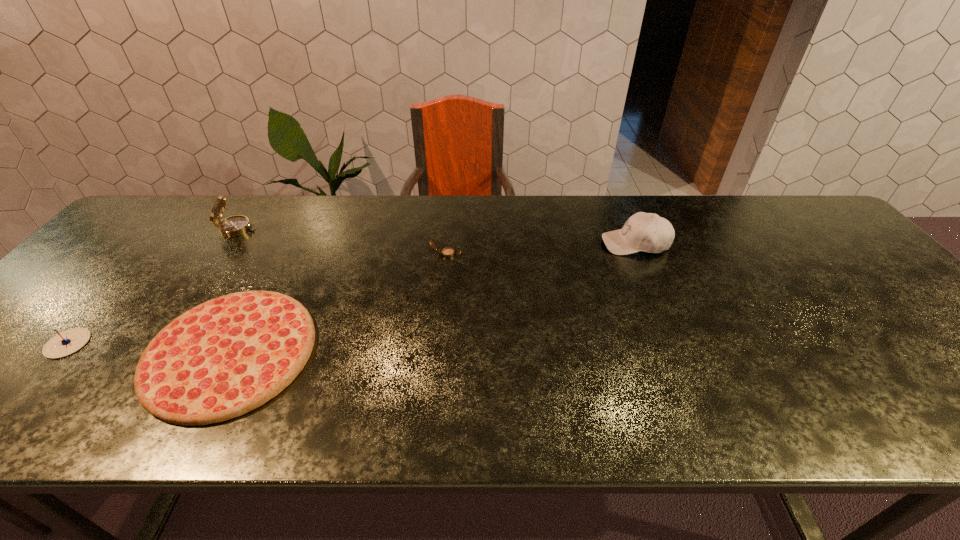
You are a GUI agent. You are given a task and a screenshot of the screen. Output one action in this format:
    pyautogui.click(x=<x>, y=<y>)
    Task: Click on the free space at the near edge of the desktop
    The image size is (960, 540).
    Given the screenshot: What is the action you would take?
    pyautogui.click(x=915, y=403)

Locate an element on the screen. The width and height of the screenshot is (960, 540). blank area at the left edge is located at coordinates (138, 240).

The height and width of the screenshot is (540, 960). In the image, there is a desktop. Identify the location of vacant space at the right edge. (878, 292).

The height and width of the screenshot is (540, 960). What are the coordinates of `blank space at the far right corner of the desktop` in the screenshot? It's located at (770, 206).

Locate an element on the screen. Image resolution: width=960 pixels, height=540 pixels. empty space between the baseball cap and the farthest compass is located at coordinates (436, 237).

The image size is (960, 540). What are the coordinates of `free space between the leftmost object and the tallest compass` in the screenshot? It's located at (153, 286).

This screenshot has width=960, height=540. I want to click on free space between the nearest compass and the second compass from left to right, so click(153, 286).

This screenshot has width=960, height=540. I want to click on free spot between the baseball cap and the leftmost object, so pos(351,293).

This screenshot has width=960, height=540. I want to click on free space between the fourth object from left to right and the tallest compass, so click(342, 241).

I want to click on unoccupied area between the leftmost object and the second compass from right to left, so click(153, 286).